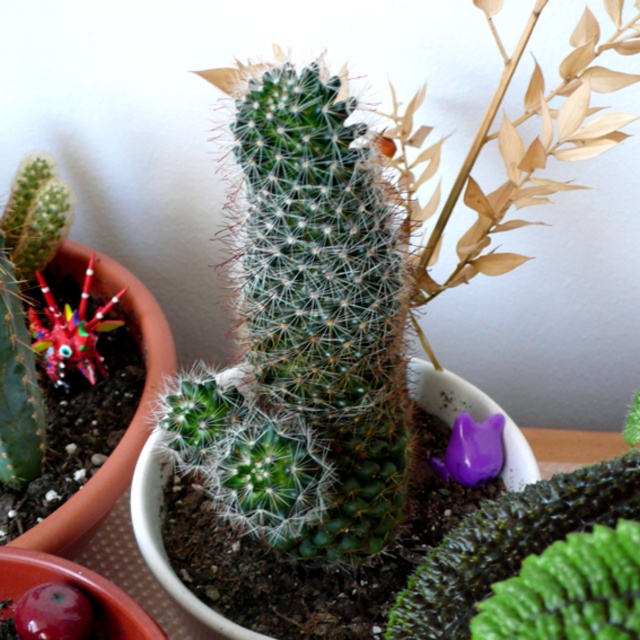
Does glossy plastic flower at center lie behind purple matte cat at lower right?

No, it is in front of purple matte cat at lower right.

Looking at this image, between glossy plastic flower at center and purple matte cat at lower right, which one appears on the left side from the viewer's perspective?

glossy plastic flower at center is more to the left.

Does point (81, 592) lie behind point (476, 426)?

No.

At what (x,y) coordinates should I click in order to perform the action: click on glossy plastic flower at center. Please return your answer as a coordinate pair (x, y). Looking at the image, I should click on (52, 612).

Image resolution: width=640 pixels, height=640 pixels. Describe the element at coordinates (72, 330) in the screenshot. I see `multicolored plastic flower at left` at that location.

Who is shorter, multicolored plastic flower at left or glossy plastic flower at center?

Standing shorter between the two is glossy plastic flower at center.

What do you see at coordinates (72, 330) in the screenshot?
I see `multicolored plastic flower at left` at bounding box center [72, 330].

Find the location of a particular element. The image size is (640, 640). multicolored plastic flower at left is located at coordinates (72, 330).

Can you confirm if multicolored plastic flower at left is thinner than purple matte cat at lower right?

No, multicolored plastic flower at left is not thinner than purple matte cat at lower right.

Does point (56, 372) lie in front of point (492, 440)?

No, it is not.

Locate an element on the screen. Image resolution: width=640 pixels, height=640 pixels. multicolored plastic flower at left is located at coordinates (72, 330).